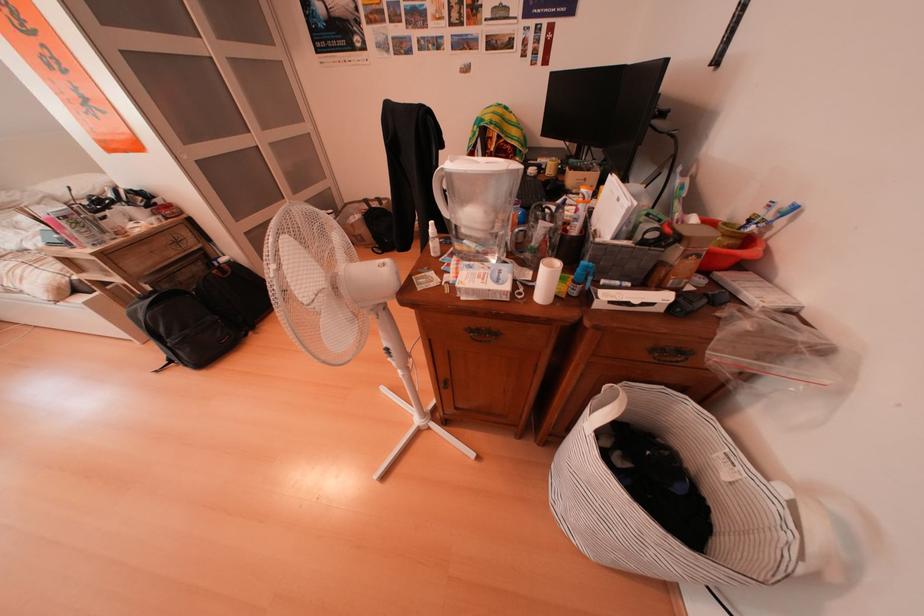
Describe the element at coordinates (611, 407) in the screenshot. I see `the laundry basket handle` at that location.